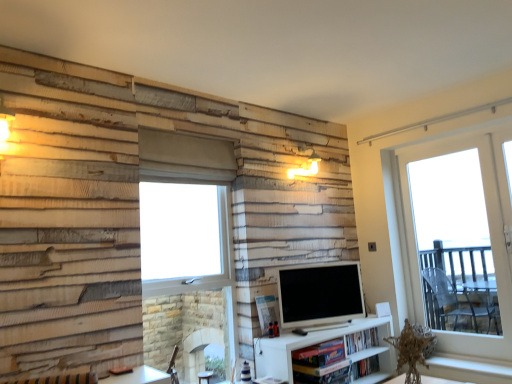
Question: In terms of width, does clear glass window at center, placed as the 2th window when sorted from right to left, look wider or thinner when compared to matte white tv at center?

Choices:
 (A) thin
 (B) wide

Answer: (B)

Question: From their relative heights in the image, would you say clear glass window at center, placed as the 2th window when sorted from right to left, is taller or shorter than matte white tv at center?

Choices:
 (A) tall
 (B) short

Answer: (A)

Question: Considering the real-world distances, which object is farthest from the transparent glass door at right, marked as the first window in a right-to-left arrangement?

Choices:
 (A) clear glass window at center, which appears as the first window when viewed from the left
 (B) hardcover book at center
 (C) white wood window sill at lower right
 (D) matte white tv at center

Answer: (A)

Question: Which of these objects is positioned closest to the hardcover book at center?

Choices:
 (A) white wood window sill at lower right
 (B) clear glass window at center, placed as the 2th window when sorted from right to left
 (C) matte white tv at center
 (D) transparent glass door at right, placed as the second window when sorted from left to right

Answer: (C)